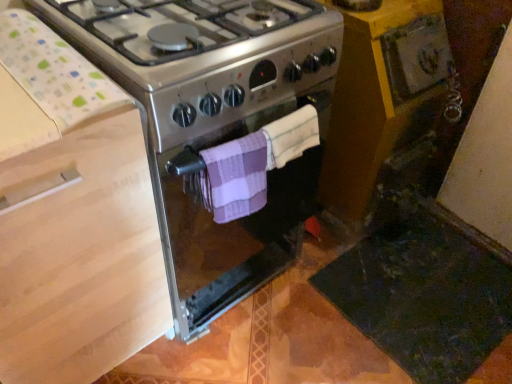
The height and width of the screenshot is (384, 512). What do you see at coordinates (81, 259) in the screenshot?
I see `wooden at left` at bounding box center [81, 259].

Where is `yellow wood cabinet at lower right`? The width and height of the screenshot is (512, 384). yellow wood cabinet at lower right is located at coordinates tap(381, 94).

This screenshot has width=512, height=384. In order to click on wooden at left in this screenshot , I will do `click(81, 259)`.

Is purple checkered towel at center, positioned as the 1th towel/napkin in left-to-right order, completely or partially inside yellow wood cabinet at lower right?

No, purple checkered towel at center, positioned as the 1th towel/napkin in left-to-right order, is not a part of yellow wood cabinet at lower right.

From the image's perspective, is yellow wood cabinet at lower right above or below purple checkered towel at center, which is counted as the 2th towel/napkin, starting from the right?

yellow wood cabinet at lower right is situated higher than purple checkered towel at center, which is counted as the 2th towel/napkin, starting from the right, in the image.

Is the position of yellow wood cabinet at lower right less distant than that of purple checkered towel at center, positioned as the 1th towel/napkin in left-to-right order?

No.

Is wooden at left taller or shorter than purple checkered towel at center, arranged as the 2th towel/napkin when viewed from the left?

Considering their sizes, wooden at left has more height than purple checkered towel at center, arranged as the 2th towel/napkin when viewed from the left.

Is purple checkered towel at center, which ranks as the first towel/napkin in right-to-left order, completely or partially inside wooden at left?

Definitely not — purple checkered towel at center, which ranks as the first towel/napkin in right-to-left order, is not inside wooden at left.

Is wooden at left not near purple checkered towel at center, arranged as the 2th towel/napkin when viewed from the left?

They are positioned close to each other.

Which is nearer, (x=28, y=312) or (x=272, y=138)?

Point (x=28, y=312)

Is purple checkered towel at center, positioned as the 1th towel/napkin in left-to-right order, wider or thinner than satin silver gas stove at center?

In the image, purple checkered towel at center, positioned as the 1th towel/napkin in left-to-right order, appears to be more narrow than satin silver gas stove at center.

Locate an element on the screen. This screenshot has width=512, height=384. gas stove that is above the purple checkered towel at center, which is counted as the 2th towel/napkin, starting from the right (from the image's perspective) is located at coordinates (215, 124).

From the picture: From a real-world perspective, between purple checkered towel at center, which is counted as the 2th towel/napkin, starting from the right, and satin silver gas stove at center, who is vertically lower?

satin silver gas stove at center, from a real-world perspective.

Does wooden at left lie behind satin silver gas stove at center?

No, the depth of wooden at left is less than that of satin silver gas stove at center.

Is wooden at left placed right next to satin silver gas stove at center?

No, wooden at left is not with satin silver gas stove at center.

Could you tell me if wooden at left is facing satin silver gas stove at center?

No, wooden at left is not oriented towards satin silver gas stove at center.

Is purple checkered towel at center, arranged as the 2th towel/napkin when viewed from the left, to the left of purple checkered towel at center, positioned as the 1th towel/napkin in left-to-right order, from the viewer's perspective?

Incorrect, purple checkered towel at center, arranged as the 2th towel/napkin when viewed from the left, is not on the left side of purple checkered towel at center, positioned as the 1th towel/napkin in left-to-right order.

From a real-world perspective, who is located lower, purple checkered towel at center, which ranks as the first towel/napkin in right-to-left order, or purple checkered towel at center, positioned as the 1th towel/napkin in left-to-right order?

In real-world perspective, purple checkered towel at center, positioned as the 1th towel/napkin in left-to-right order, is lower.

From their relative heights in the image, would you say purple checkered towel at center, which ranks as the first towel/napkin in right-to-left order, is taller or shorter than purple checkered towel at center, which is counted as the 2th towel/napkin, starting from the right?

Considering their sizes, purple checkered towel at center, which ranks as the first towel/napkin in right-to-left order, has less height than purple checkered towel at center, which is counted as the 2th towel/napkin, starting from the right.

Is purple checkered towel at center, arranged as the 2th towel/napkin when viewed from the left, next to purple checkered towel at center, which is counted as the 2th towel/napkin, starting from the right?

Absolutely, purple checkered towel at center, arranged as the 2th towel/napkin when viewed from the left, is next to and touching purple checkered towel at center, which is counted as the 2th towel/napkin, starting from the right.

From the image's perspective, is purple checkered towel at center, arranged as the 2th towel/napkin when viewed from the left, located above or below satin silver gas stove at center?

From the image's perspective, purple checkered towel at center, arranged as the 2th towel/napkin when viewed from the left, appears above satin silver gas stove at center.

Is the position of purple checkered towel at center, arranged as the 2th towel/napkin when viewed from the left, more distant than that of satin silver gas stove at center?

Yes.

What's the angular difference between purple checkered towel at center, arranged as the 2th towel/napkin when viewed from the left, and satin silver gas stove at center's facing directions?

purple checkered towel at center, arranged as the 2th towel/napkin when viewed from the left, and satin silver gas stove at center are facing 2.89 degrees away from each other.

Which of these two, purple checkered towel at center, positioned as the 1th towel/napkin in left-to-right order, or purple checkered towel at center, arranged as the 2th towel/napkin when viewed from the left, is smaller?

With smaller size is purple checkered towel at center, arranged as the 2th towel/napkin when viewed from the left.

In the scene shown: Which object is closer to the camera, purple checkered towel at center, positioned as the 1th towel/napkin in left-to-right order, or purple checkered towel at center, arranged as the 2th towel/napkin when viewed from the left?

purple checkered towel at center, positioned as the 1th towel/napkin in left-to-right order.

From the image's perspective, would you say purple checkered towel at center, which is counted as the 2th towel/napkin, starting from the right, is shown under purple checkered towel at center, which ranks as the first towel/napkin in right-to-left order?

Yes.

Which object is positioned more to the right, purple checkered towel at center, which is counted as the 2th towel/napkin, starting from the right, or purple checkered towel at center, arranged as the 2th towel/napkin when viewed from the left?

From the viewer's perspective, purple checkered towel at center, arranged as the 2th towel/napkin when viewed from the left, appears more on the right side.

You are a GUI agent. You are given a task and a screenshot of the screen. Output one action in this format:
    pyautogui.click(x=<x>, y=<y>)
    Task: Click on the cabinetry that appears below the purple checkered towel at center, positioned as the 1th towel/napkin in left-to-right order (from a real-world perspective)
    
    Given the screenshot: What is the action you would take?
    pyautogui.click(x=381, y=94)

Find the location of `drawer lying below the purple checkered towel at center, arranged as the 2th towel/napkin when viewed from the left (from the image's perspective)`. drawer lying below the purple checkered towel at center, arranged as the 2th towel/napkin when viewed from the left (from the image's perspective) is located at coordinates (81, 259).

Looking at the image, which one is located further to yellow wood cabinet at lower right, wooden at left or purple checkered towel at center, positioned as the 1th towel/napkin in left-to-right order?

Among the two, wooden at left is located further to yellow wood cabinet at lower right.

From the image, which object appears to be farther from purple checkered towel at center, positioned as the 1th towel/napkin in left-to-right order, satin silver gas stove at center or wooden at left?

The object further to purple checkered towel at center, positioned as the 1th towel/napkin in left-to-right order, is wooden at left.

Considering their positions, is wooden at left positioned closer to purple checkered towel at center, arranged as the 2th towel/napkin when viewed from the left, than satin silver gas stove at center?

Based on the image, satin silver gas stove at center appears to be nearer to purple checkered towel at center, arranged as the 2th towel/napkin when viewed from the left.

Considering their positions, is wooden at left positioned closer to yellow wood cabinet at lower right than purple checkered towel at center, which ranks as the first towel/napkin in right-to-left order?

purple checkered towel at center, which ranks as the first towel/napkin in right-to-left order, lies closer to yellow wood cabinet at lower right than the other object.

Based on their spatial positions, is yellow wood cabinet at lower right or satin silver gas stove at center closer to wooden at left?

Among the two, satin silver gas stove at center is located nearer to wooden at left.

When comparing their distances from purple checkered towel at center, positioned as the 1th towel/napkin in left-to-right order, does wooden at left or yellow wood cabinet at lower right seem further?

Based on the image, yellow wood cabinet at lower right appears to be further to purple checkered towel at center, positioned as the 1th towel/napkin in left-to-right order.

Which object lies further to the anchor point purple checkered towel at center, which is counted as the 2th towel/napkin, starting from the right, wooden at left or purple checkered towel at center, arranged as the 2th towel/napkin when viewed from the left?

Based on the image, wooden at left appears to be further to purple checkered towel at center, which is counted as the 2th towel/napkin, starting from the right.

Based on their spatial positions, is purple checkered towel at center, which is counted as the 2th towel/napkin, starting from the right, or yellow wood cabinet at lower right further from wooden at left?

yellow wood cabinet at lower right.

At what (x,y) coordinates should I click in order to perform the action: click on gas stove situated between wooden at left and purple checkered towel at center, positioned as the 1th towel/napkin in left-to-right order, from left to right. Please return your answer as a coordinate pair (x, y). Looking at the image, I should click on (215, 124).

Image resolution: width=512 pixels, height=384 pixels. Identify the location of towel/napkin between wooden at left and purple checkered towel at center, arranged as the 2th towel/napkin when viewed from the left, from left to right. (234, 177).

At what (x,y) coordinates should I click in order to perform the action: click on towel/napkin situated between satin silver gas stove at center and purple checkered towel at center, which ranks as the first towel/napkin in right-to-left order, from left to right. Please return your answer as a coordinate pair (x, y). Looking at the image, I should click on (234, 177).

Locate an element on the screen. The height and width of the screenshot is (384, 512). towel/napkin between purple checkered towel at center, which is counted as the 2th towel/napkin, starting from the right, and yellow wood cabinet at lower right is located at coordinates (291, 136).